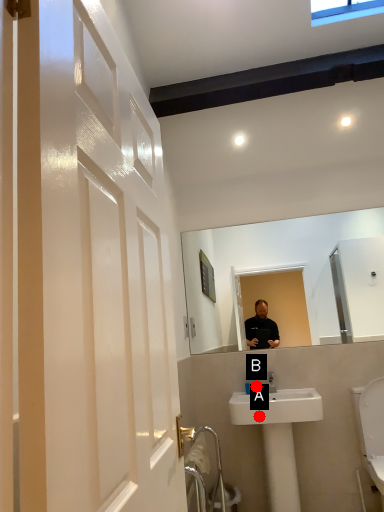
Question: Two points are circled on the image, labeled by A and B beside each circle. Which of the following is the closest to the observer?

Choices:
 (A) A is closer
 (B) B is closer

Answer: (A)